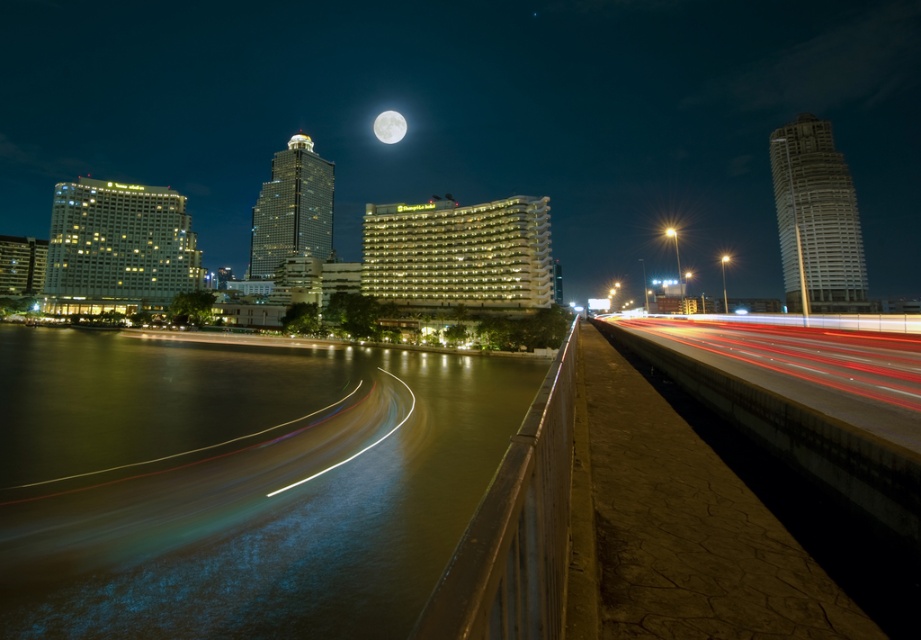
Between smooth concrete bridge at center and white glossy moon at upper center, which one has less height?

white glossy moon at upper center

Is smooth concrete bridge at center smaller than white glossy moon at upper center?

Incorrect, smooth concrete bridge at center is not smaller in size than white glossy moon at upper center.

Between point (201, 212) and point (383, 115), which one is positioned behind?

Positioned behind is point (201, 212).

Locate an element on the screen. smooth concrete bridge at center is located at coordinates (478, 116).

Describe the element at coordinates (236, 483) in the screenshot. The image size is (921, 640). I see `greenish water at lower left` at that location.

Is greenish water at lower left shorter than smooth concrete highway at right?

In fact, greenish water at lower left may be taller than smooth concrete highway at right.

Image resolution: width=921 pixels, height=640 pixels. Describe the element at coordinates (236, 483) in the screenshot. I see `greenish water at lower left` at that location.

Identify the location of greenish water at lower left. (236, 483).

Between smooth concrete bridge at center and greenish water at lower left, which one has more height?

smooth concrete bridge at center is taller.

Does smooth concrete bridge at center have a lesser height compared to greenish water at lower left?

No, smooth concrete bridge at center is not shorter than greenish water at lower left.

Between point (53, 72) and point (150, 474), which one is positioned behind?

The point (53, 72) is more distant.

I want to click on smooth concrete bridge at center, so click(478, 116).